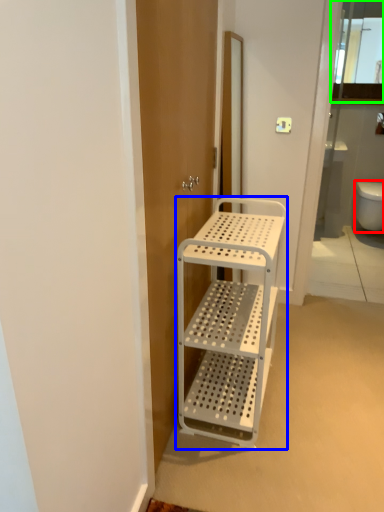
Question: Which object is the farthest from toilet bowl (highlighted by a red box)? Choose among these: furniture (highlighted by a blue box) or cabinet (highlighted by a green box).

Choices:
 (A) furniture
 (B) cabinet

Answer: (A)